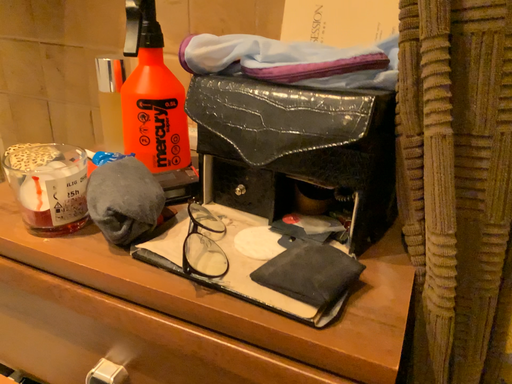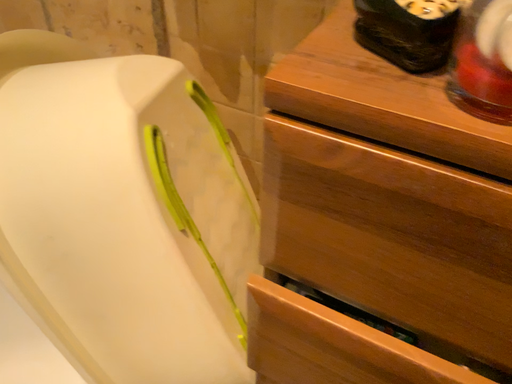
Question: How did the camera likely rotate when shooting the video?

Choices:
 (A) rotated downward
 (B) rotated upward

Answer: (A)